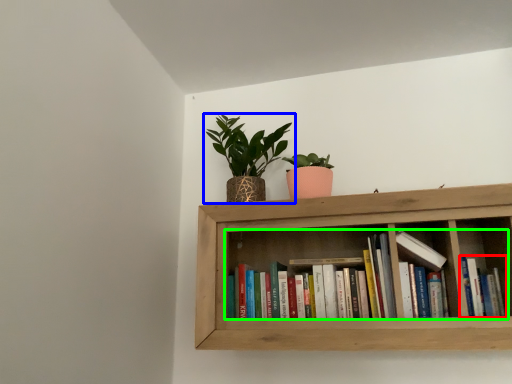
Question: Which object is positioned closest to book (highlighted by a red box)? Select from houseplant (highlighted by a blue box) and book (highlighted by a green box).

Choices:
 (A) houseplant
 (B) book

Answer: (B)